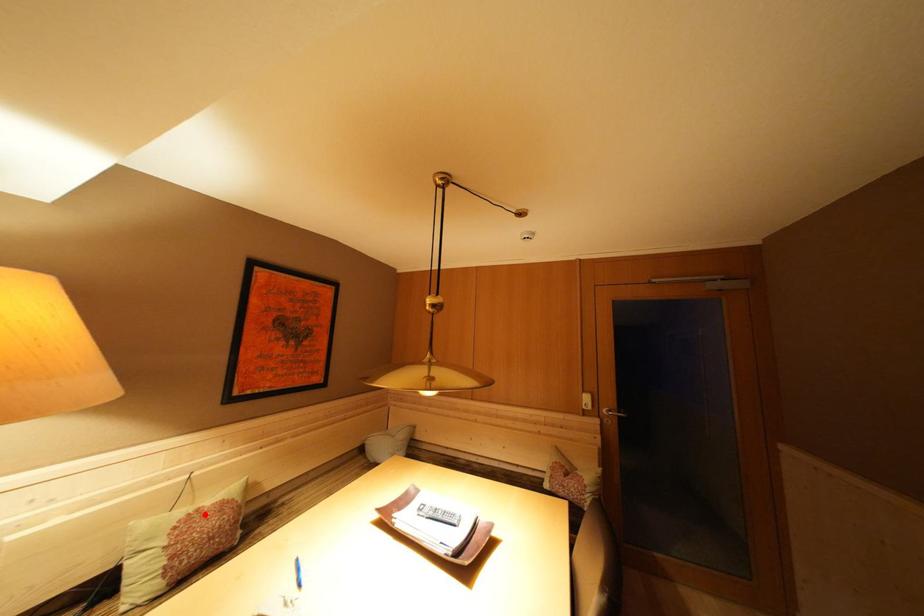
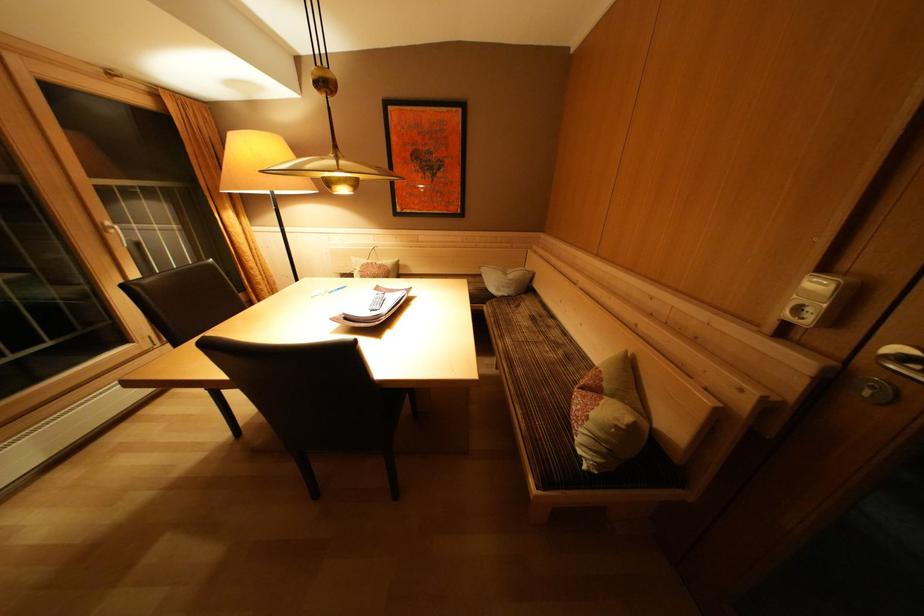
Question: I am providing you with two images of the same scene from different viewpoints. Given a red point in image1, look at the same physical point in image2. Is it:

Choices:
 (A) Closer to the viewpoint
 (B) Farther from the viewpoint

Answer: (A)